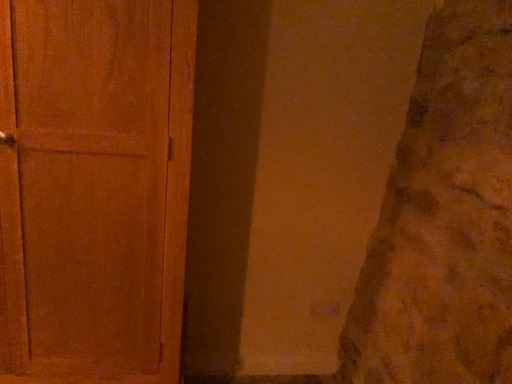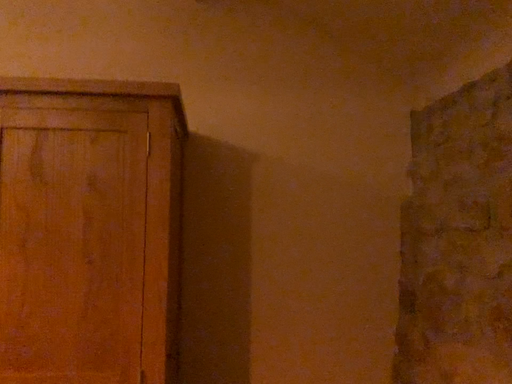
Question: How did the camera likely rotate when shooting the video?

Choices:
 (A) rotated upward
 (B) rotated downward

Answer: (A)